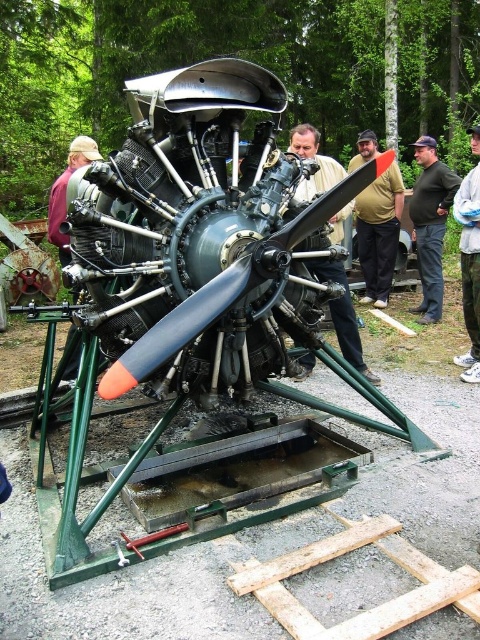
Question: Considering the relative positions of fat man at center and camouflage pants at center in the image provided, where is fat man at center located with respect to camouflage pants at center?

Choices:
 (A) left
 (B) right

Answer: (A)

Question: Which of these objects is positioned closest to the matte black propeller at center?

Choices:
 (A) camouflage pants at center
 (B) fat man at center

Answer: (A)

Question: Which object appears closest to the camera in this image?

Choices:
 (A) camouflage pants at center
 (B) fat man at center
 (C) matte black propeller at center

Answer: (C)

Question: Does fat man at center appear on the left side of camouflage pants at center?

Choices:
 (A) yes
 (B) no

Answer: (A)

Question: Is matte black propeller at center further to camera compared to camouflage pants at center?

Choices:
 (A) yes
 (B) no

Answer: (B)

Question: Which object is farther from the camera taking this photo?

Choices:
 (A) dark green pants at center
 (B) fat man at center
 (C) matte black propeller at center

Answer: (B)